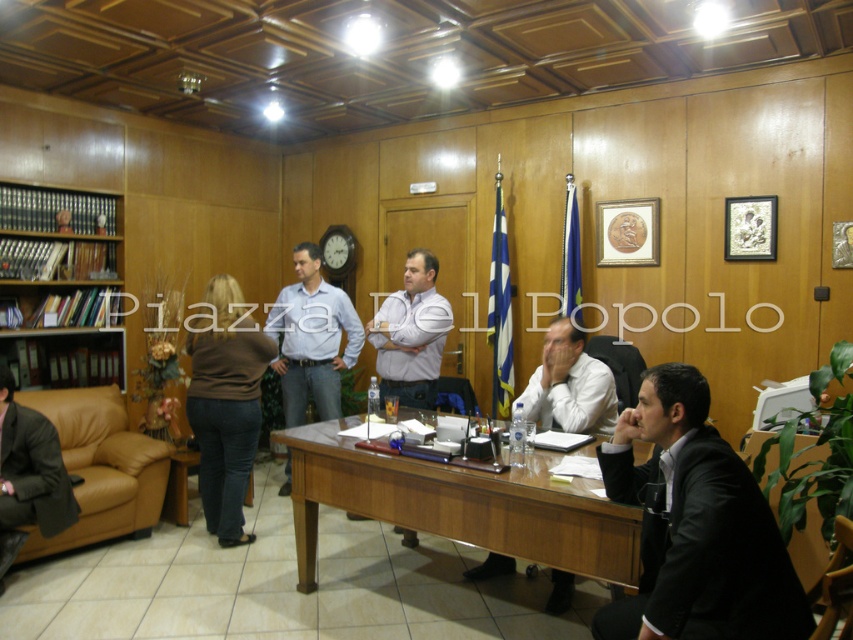
Is wooden bookshelf at left in front of light blue shirt at center?

No.

Is point (88, 280) behind point (296, 289)?

Yes, point (88, 280) is behind point (296, 289).

Identify the location of wooden bookshelf at left. (59, 260).

Between point (128, 480) and point (252, 401), which one is positioned in front?

Point (252, 401) is in front.

Who is positioned more to the left, leather couch at left or brown sweater at center?

From the viewer's perspective, leather couch at left appears more on the left side.

You are a GUI agent. You are given a task and a screenshot of the screen. Output one action in this format:
    pyautogui.click(x=<x>, y=<y>)
    Task: Click on the leather couch at left
    This screenshot has height=640, width=853.
    Given the screenshot: What is the action you would take?
    pyautogui.click(x=100, y=467)

Does brown sweater at center appear over light blue shirt at center?

Actually, brown sweater at center is below light blue shirt at center.

Is brown sweater at center in front of light blue shirt at center?

Yes, it is.

Is point (202, 448) in front of point (309, 348)?

Yes.

Identify the location of brown sweater at center. (225, 406).